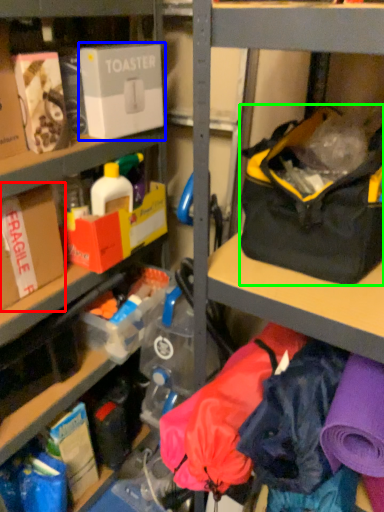
Question: Based on their relative distances, which object is nearer to box (highlighted by a red box)? Choose from box (highlighted by a blue box) and handbag (highlighted by a green box).

Choices:
 (A) box
 (B) handbag

Answer: (A)